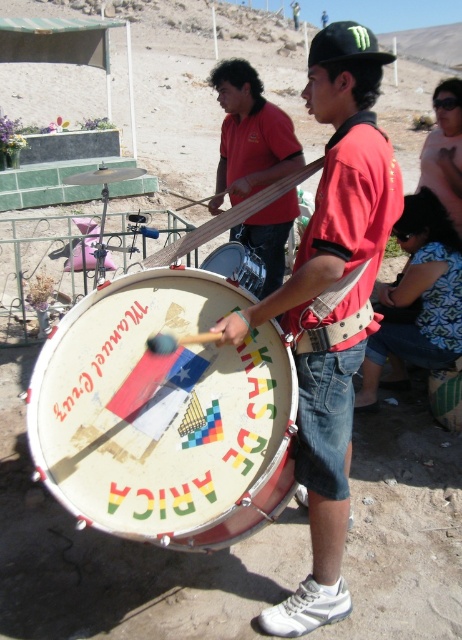
Does point (451, 221) come farther from viewer compared to point (229, 244)?

Yes.

What do you see at coordinates (444, 150) in the screenshot? This screenshot has height=640, width=462. I see `matte pink sunglasses at upper right` at bounding box center [444, 150].

Between point (456, 186) and point (233, 268), which one is positioned in front?

Positioned in front is point (233, 268).

Identify the location of matte pink sunglasses at upper right. This screenshot has width=462, height=640. (444, 150).

Can you confirm if white painted drum at center is shorter than blue denim shorts at lower right?

Yes, white painted drum at center is shorter than blue denim shorts at lower right.

Is white painted drum at center to the left of blue denim shorts at lower right from the viewer's perspective?

Indeed, white painted drum at center is positioned on the left side of blue denim shorts at lower right.

Who is more distant from viewer, (208,516) or (425,353)?

The point (425,353) is more distant.

In order to click on white painted drum at center in this screenshot , I will do `click(164, 416)`.

Can you confirm if blue denim shorts at lower right is shorter than white leather drum at center?

Incorrect, blue denim shorts at lower right's height does not fall short of white leather drum at center's.

Does point (412, 243) lie in front of point (232, 243)?

No, it is behind (232, 243).

Is point (445, 308) farther from camera compared to point (249, 285)?

Yes.

Identify the location of blue denim shorts at lower right. This screenshot has width=462, height=640. (419, 298).